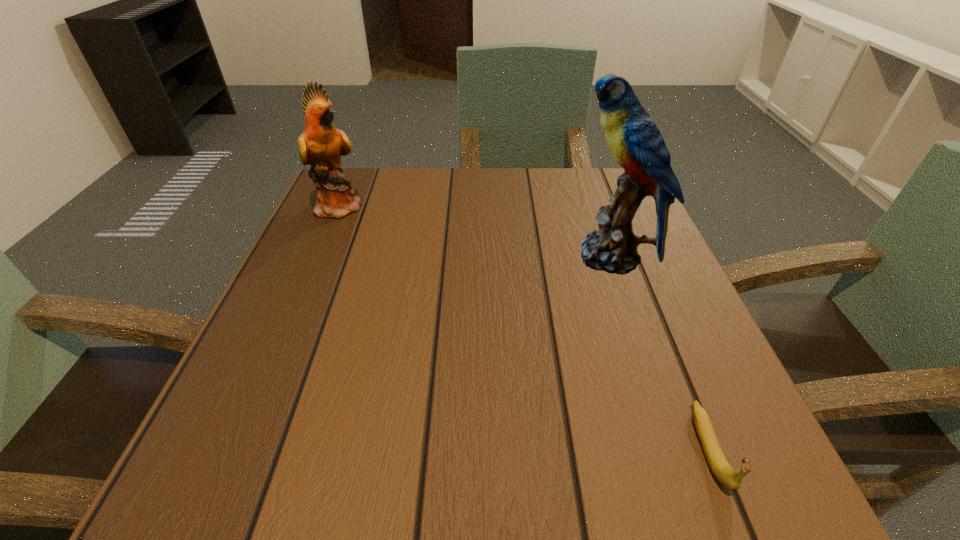
Where is `vacant point located between the nearest object and the leftmost object`? The width and height of the screenshot is (960, 540). vacant point located between the nearest object and the leftmost object is located at coordinates (525, 328).

At what (x,y) coordinates should I click in order to perform the action: click on free spot between the second shortest object and the taller parrot. Please return your answer as a coordinate pair (x, y). The width and height of the screenshot is (960, 540). Looking at the image, I should click on (475, 232).

Find the location of a particular element. unoccupied area between the second farthest object and the farther parrot is located at coordinates (475, 232).

At what (x,y) coordinates should I click in order to perform the action: click on blank region between the nearest object and the farthest object. Please return your answer as a coordinate pair (x, y). Looking at the image, I should click on (525, 328).

Select which object is the closest to the nearest object. Please provide its 2D coordinates. Your answer should be formatted as a tuple, i.e. [(x, y)], where the tuple contains the x and y coordinates of a point satisfying the conditions above.

[(636, 143)]

Where is `the closest object to the leftmost object`? The image size is (960, 540). the closest object to the leftmost object is located at coordinates (636, 143).